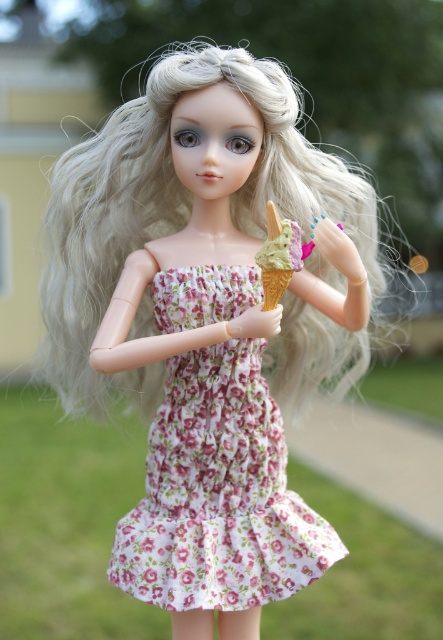
You are standing in front of a doll wearing a floral dress with pink flowers and green leaves. The doll has one hand holding an ice cream cone with a pink heart decoration and another hand raised. There is a point at coordinates point (279, 380). Can you reach this point with your outstretched hand if you are 1.20 meters away from it?

The distance between point (279, 380) and the camera is 1.20 meters. Since you are standing 1.20 meters away from the point, you can reach it with your outstretched hand if your arm length is at least that distance.